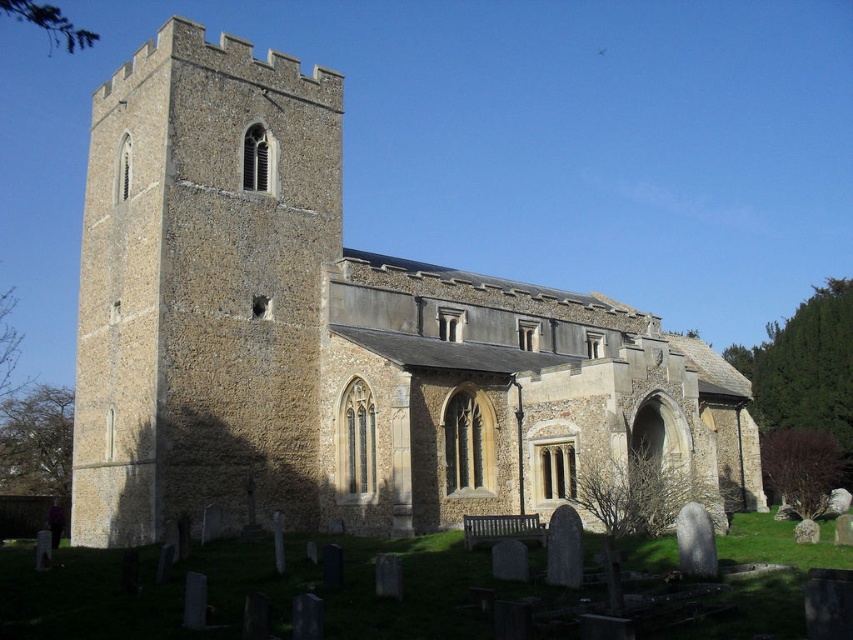
Question: Which point is closer to the camera?

Choices:
 (A) brown stone tower at left
 (B) brown stone church at center

Answer: (B)

Question: Is brown stone church at center positioned before brown stone tower at left?

Choices:
 (A) yes
 (B) no

Answer: (A)

Question: Does brown stone church at center have a greater width compared to brown stone tower at left?

Choices:
 (A) no
 (B) yes

Answer: (B)

Question: Which of the following is the farthest from the observer?

Choices:
 (A) brown stone tower at left
 (B) brown stone church at center

Answer: (A)

Question: Among these points, which one is farthest from the camera?

Choices:
 (A) (299, 456)
 (B) (154, 186)

Answer: (A)

Question: Can you confirm if brown stone church at center is thinner than brown stone tower at left?

Choices:
 (A) no
 (B) yes

Answer: (A)